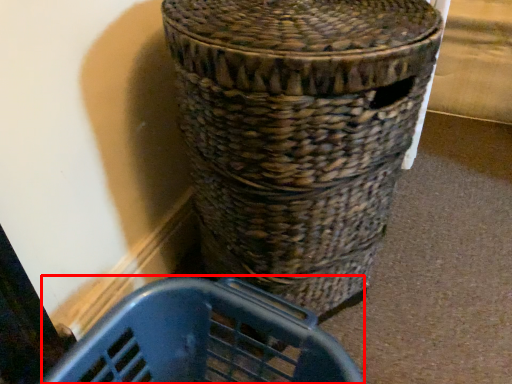
Question: Considering the relative positions of basket container (annotated by the red box) and waste container in the image provided, where is basket container (annotated by the red box) located with respect to the staircase?

Choices:
 (A) left
 (B) right

Answer: (A)